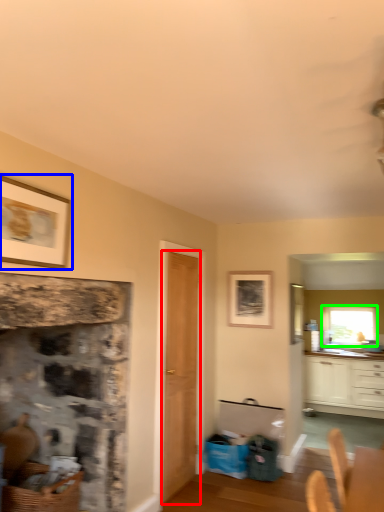
Question: Estimate the real-world distances between objects in this image. Which object is farther from door (highlighted by a red box), picture frame (highlighted by a blue box) or window (highlighted by a green box)?

Choices:
 (A) picture frame
 (B) window

Answer: (B)